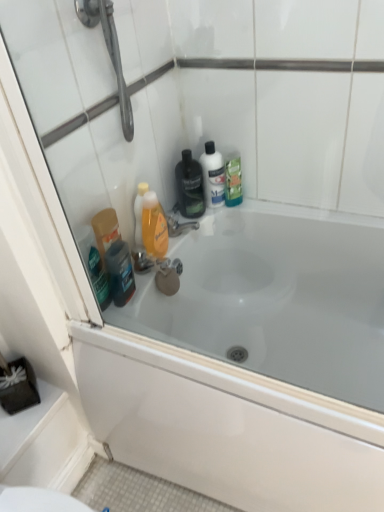
Image resolution: width=384 pixels, height=512 pixels. Find the location of `free space in front of shiny dark blue bottle at lower left`. free space in front of shiny dark blue bottle at lower left is located at coordinates (128, 330).